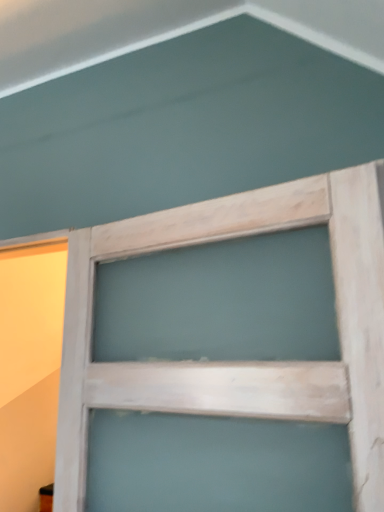
Describe the element at coordinates (243, 362) in the screenshot. I see `white wood window at upper center` at that location.

Locate an element on the screen. The image size is (384, 512). white wood window at upper center is located at coordinates (243, 362).

Locate an element on the screen. Image resolution: width=384 pixels, height=512 pixels. white wood window at upper center is located at coordinates (243, 362).